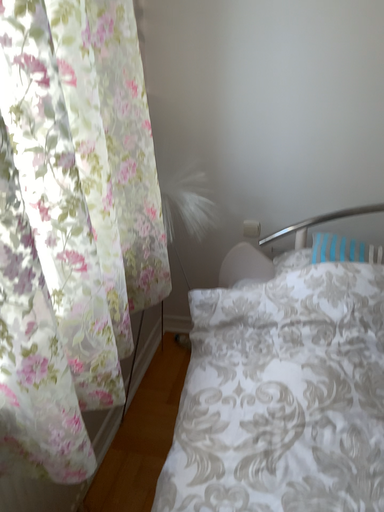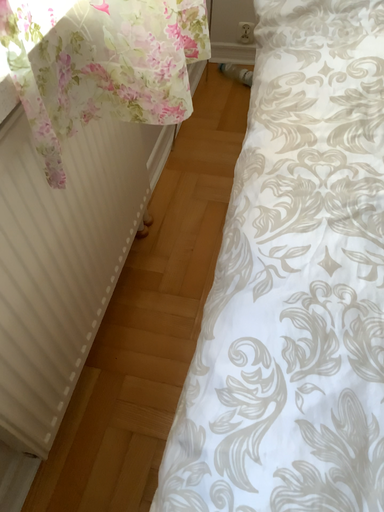
Question: Which way did the camera rotate in the video?

Choices:
 (A) rotated downward
 (B) rotated upward

Answer: (A)